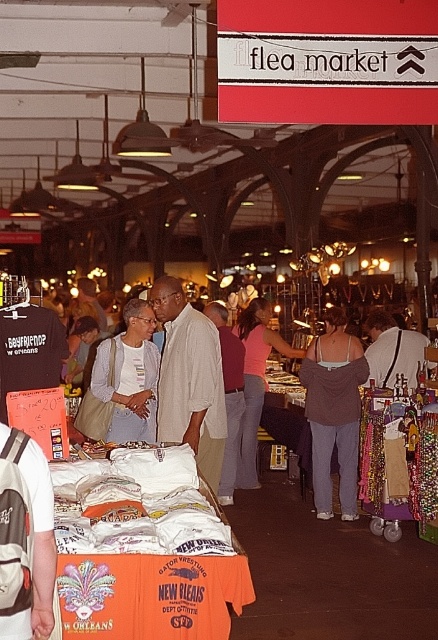
Consider the image. You are standing at the entrance of the flea market and want to locate two specific points marked in the scene. The first point is at coordinate point (328, 333) and the second is at coordinate point (254, 429). Which point is closer to you?

Point (328, 333) is closer to the viewer than point (254, 429).

You are a vendor at the flea market and want to display both the beige cotton shirt at center and the light blue denim jacket at center on a narrow shelf. Which item should you place first to ensure both fit side by side?

You should place the light blue denim jacket at center first since the beige cotton shirt at center might be wider and could take up more space, allowing both items to fit side by side on the narrow shelf.